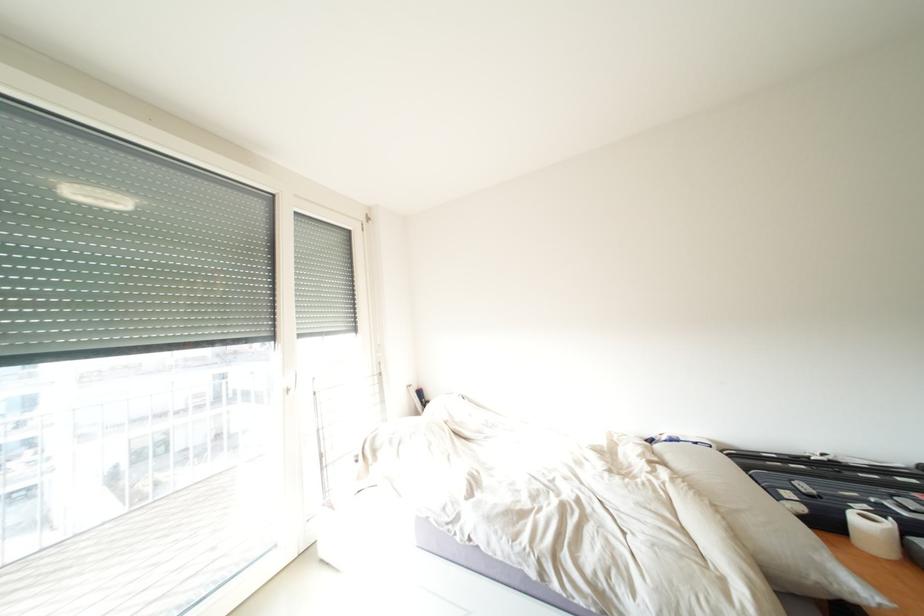
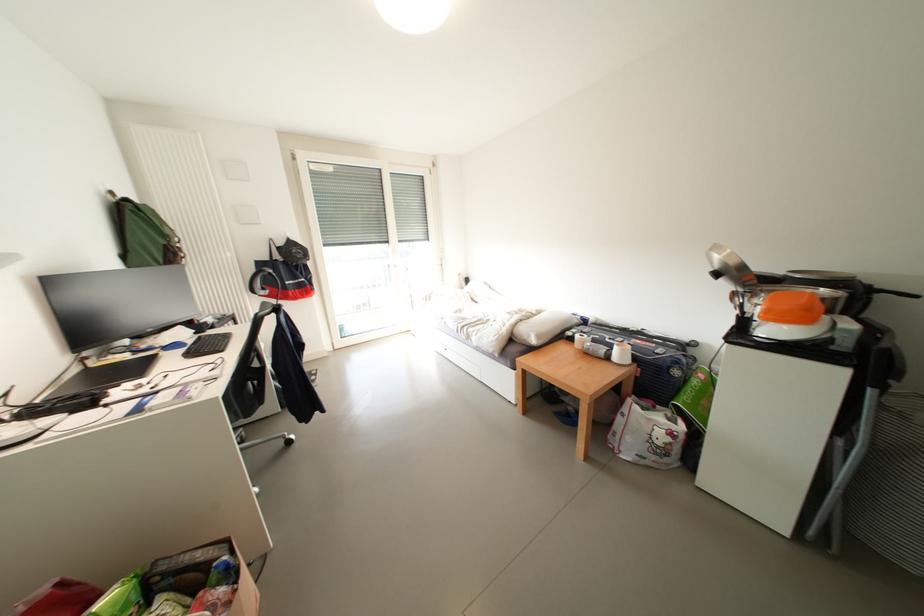
In the second image, find the point that corresponds to the point at 822,581 in the first image.

(532, 341)